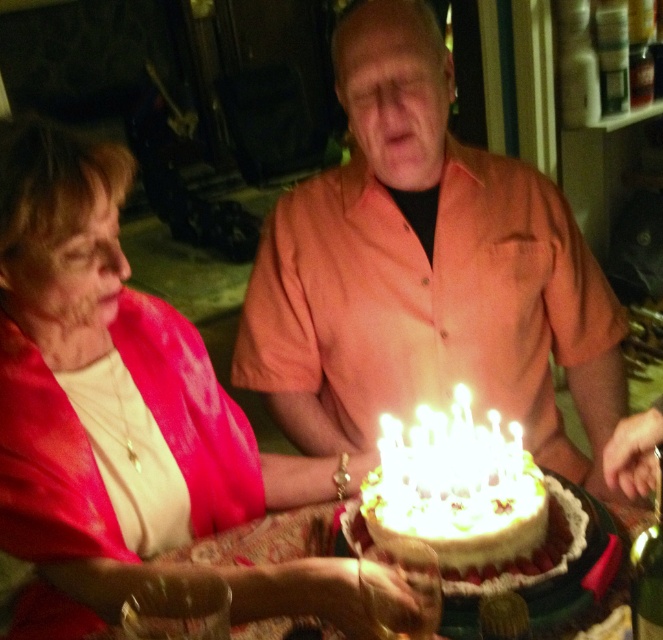
You are standing in front of the birthday cake at the center of the scene. Which direction should you look to see the orange matte shirt at center?

The orange matte shirt at center is located at point (426, 272), so you should look towards the lower right direction from the birthday cake at center to see it.

You are a photographer at the birthday celebration. You need to capture a photo where both the orange matte shirt at center and the white frosted cake at center are clearly visible. Based on their positions, which object should you focus on first to ensure both are in frame?

The orange matte shirt at center is located above the white frosted cake at center, so focusing on the orange matte shirt at center first will ensure both are in frame as the cake is below it.